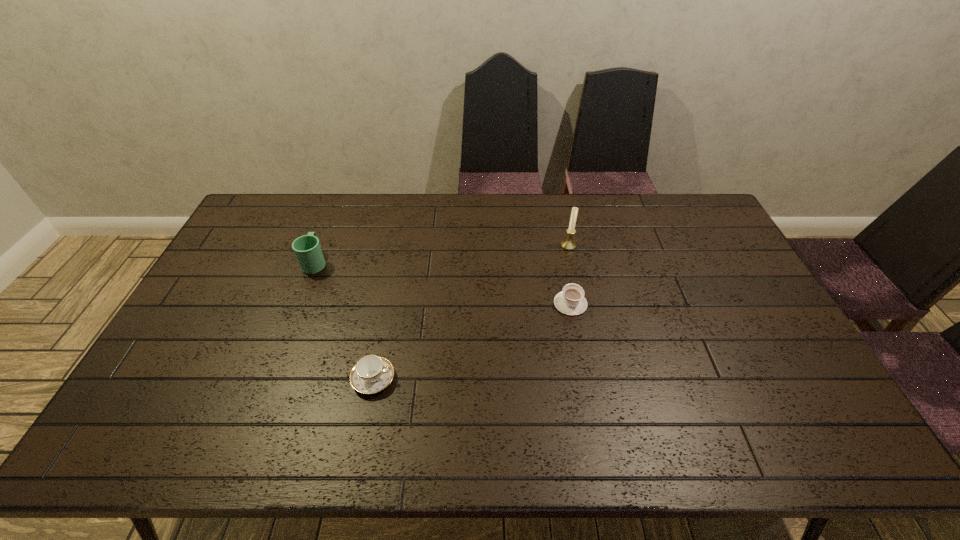
Find the location of a particular element. The width and height of the screenshot is (960, 540). empty space that is in between the nearer teacup and the second tallest object is located at coordinates (345, 321).

Select which object appears as the second closest to the right teacup. Please provide its 2D coordinates. Your answer should be formatted as a tuple, i.e. [(x, y)], where the tuple contains the x and y coordinates of a point satisfying the conditions above.

[(371, 374)]

The height and width of the screenshot is (540, 960). I want to click on the second closest object to the right teacup, so click(371, 374).

Identify the location of free space in the image that satisfies the following two spatial constraints: 1. on the side of the leftmost object with the handle; 2. on the left side of the candle holder. This screenshot has height=540, width=960. (322, 246).

In order to click on vacant space that satisfies the following two spatial constraints: 1. on the side of the tallest object with the handle; 2. on the left side of the second tallest object in this screenshot , I will do `click(322, 246)`.

Find the location of a particular element. The image size is (960, 540). blank space that satisfies the following two spatial constraints: 1. on the front side of the tallest object; 2. on the side with the handle of the nearest object is located at coordinates (597, 379).

Where is `blank space that satisfies the following two spatial constraints: 1. on the handle side of the right teacup; 2. on the right side of the candle holder`? The height and width of the screenshot is (540, 960). blank space that satisfies the following two spatial constraints: 1. on the handle side of the right teacup; 2. on the right side of the candle holder is located at coordinates click(560, 246).

At what (x,y) coordinates should I click in order to perform the action: click on free space that satisfies the following two spatial constraints: 1. on the front side of the tallest object; 2. on the side with the handle of the nearest object. Please return your answer as a coordinate pair (x, y). The height and width of the screenshot is (540, 960). Looking at the image, I should click on (597, 379).

Find the location of `vacant space that satisfies the following two spatial constraints: 1. on the side of the third shortest object with the handle; 2. on the right side of the candle holder`. vacant space that satisfies the following two spatial constraints: 1. on the side of the third shortest object with the handle; 2. on the right side of the candle holder is located at coordinates (322, 246).